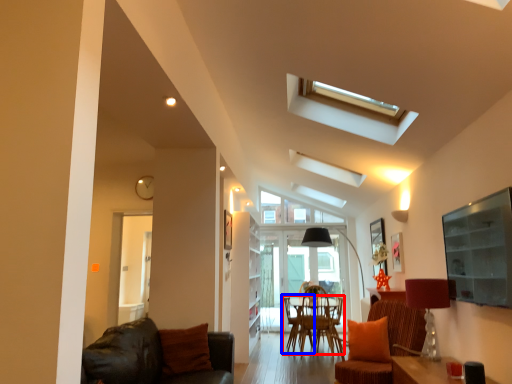
Question: Which object is closer to the camera taking this photo, chair (highlighted by a red box) or armchair (highlighted by a blue box)?

Choices:
 (A) chair
 (B) armchair

Answer: (A)